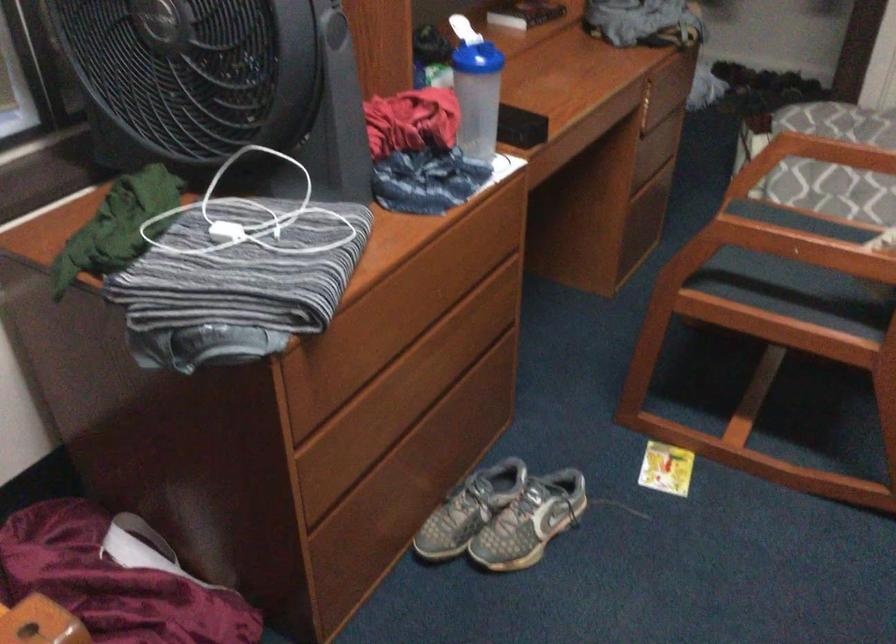
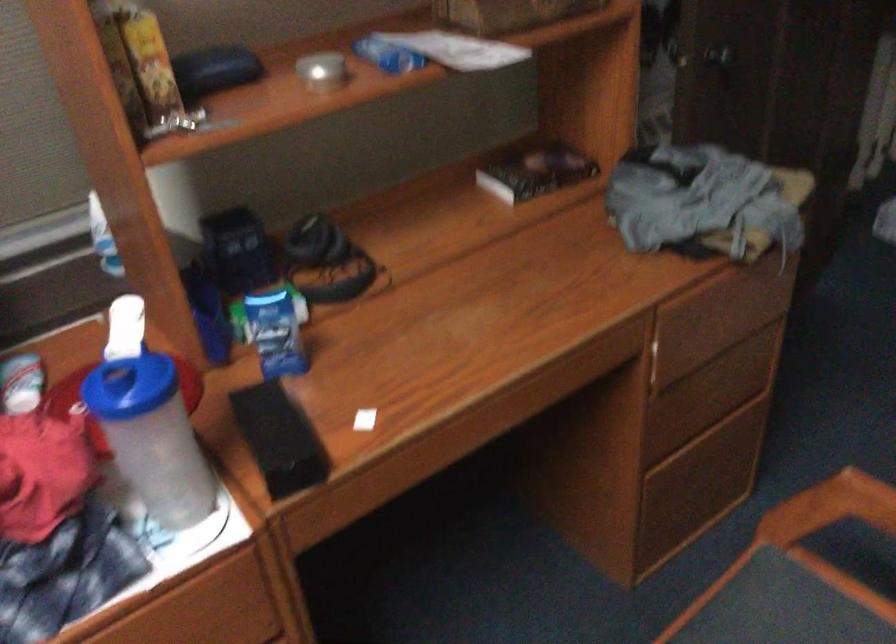
What movement of the cameraman would produce the second image?

The movement direction of the cameraman is right, forward.